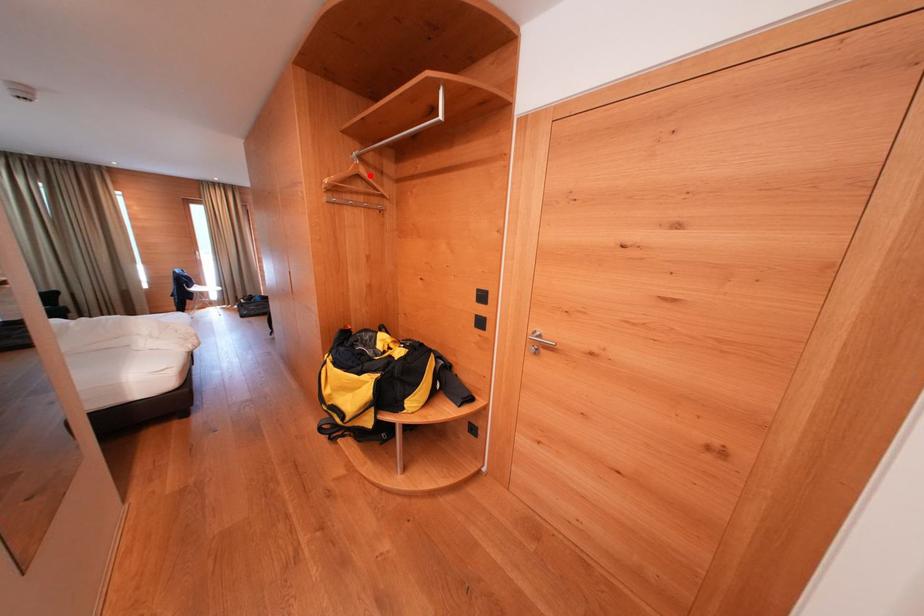
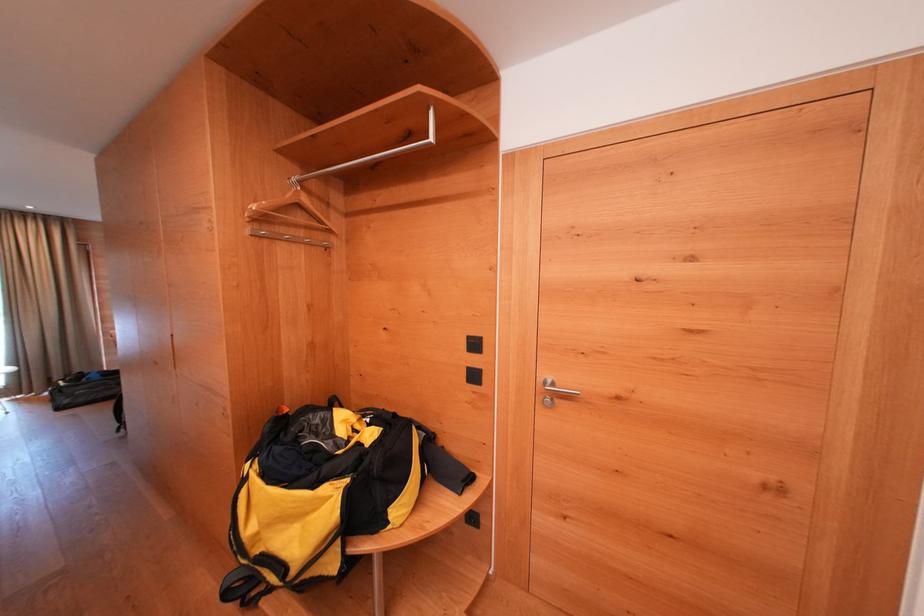
The point at the highlighted location is marked in the first image. Where is the corresponding point in the second image?

(312, 205)